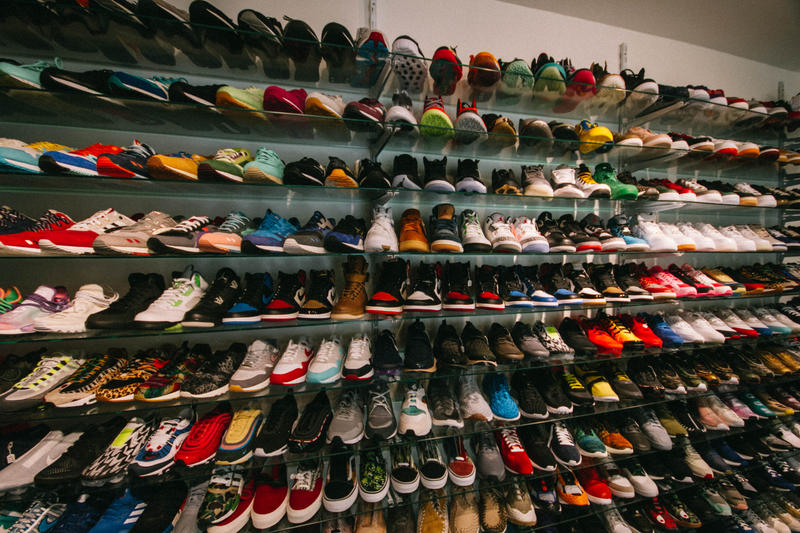
Locate an element on the screen. The image size is (800, 533). shelf is located at coordinates (553, 95), (558, 139), (560, 193), (568, 247), (568, 303), (568, 356), (582, 421), (593, 462), (616, 514).